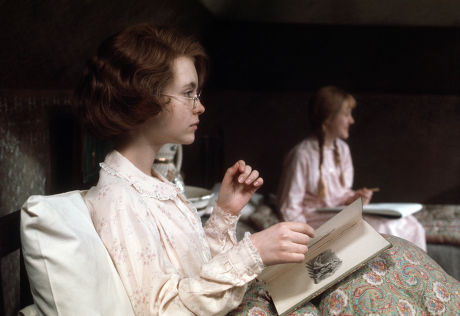
Identify the location of book. (353, 256), (347, 232).